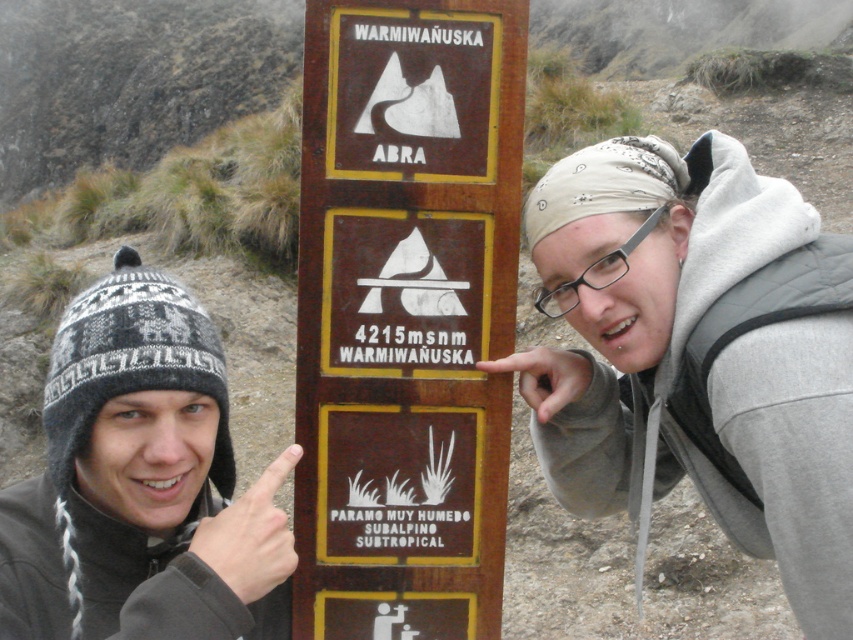
Looking at this image, can you confirm if gray hoodie at center is smaller than black plastic glasses at upper center?

No, gray hoodie at center is not smaller than black plastic glasses at upper center.

In order to click on gray hoodie at center in this screenshot , I will do `click(691, 358)`.

In order to click on gray hoodie at center in this screenshot , I will do `click(691, 358)`.

Which is above, gray hoodie at center or knitted wool hat at center?

gray hoodie at center is higher up.

Does point (653, 147) come in front of point (231, 621)?

No, it is behind (231, 621).

Where is `gray hoodie at center`? This screenshot has width=853, height=640. gray hoodie at center is located at coordinates (691, 358).

Describe the element at coordinates (405, 314) in the screenshot. I see `brown wooden sign at center` at that location.

Does point (369, 630) lie in front of point (634, 244)?

That is False.

Identify the location of brown wooden sign at center. The width and height of the screenshot is (853, 640). [405, 314].